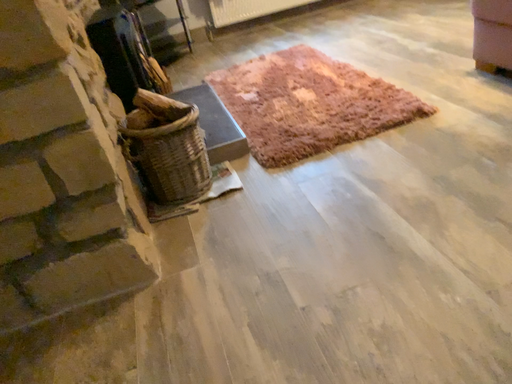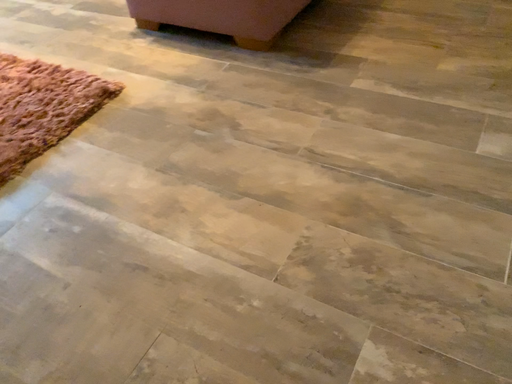
Question: How did the camera likely rotate when shooting the video?

Choices:
 (A) rotated left
 (B) rotated right

Answer: (B)